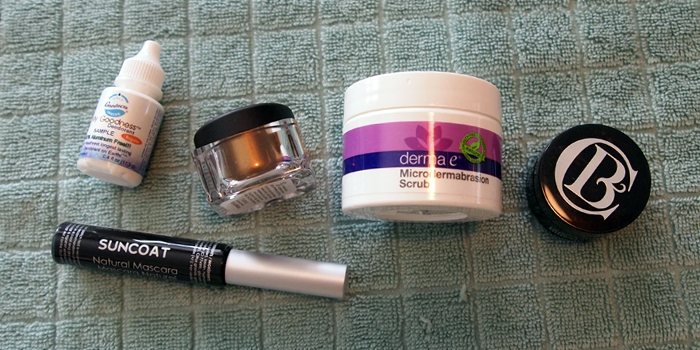
The image size is (700, 350). I want to click on clear container, so pos(244,150).